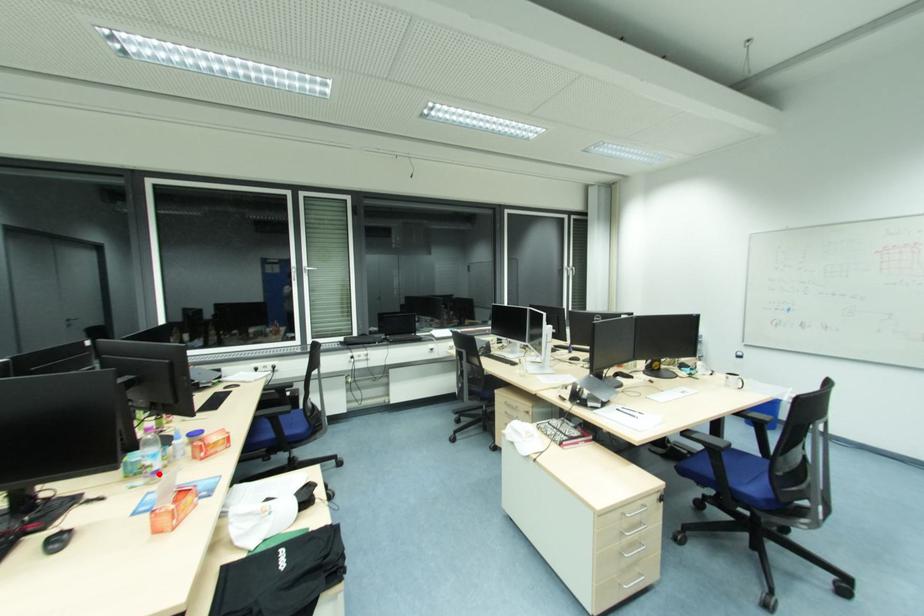
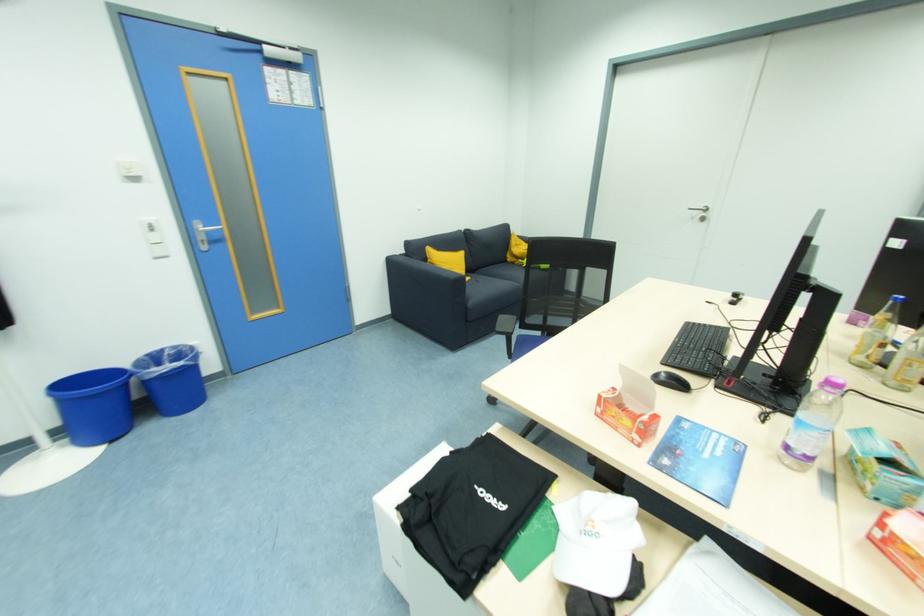
In the second image, find the point that corresponds to the highlighted location in the first image.

(792, 448)